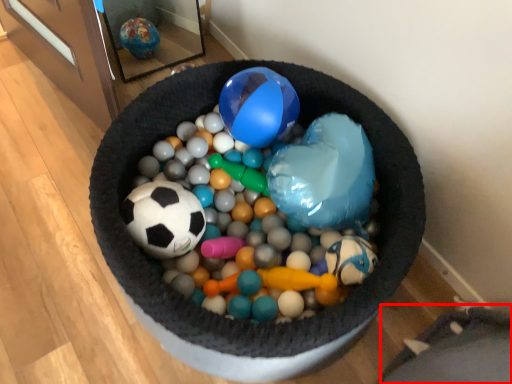
Question: From the image's perspective, what is the correct spatial relationship of bean bag chair (annotated by the red box) in relation to ball?

Choices:
 (A) above
 (B) below

Answer: (B)